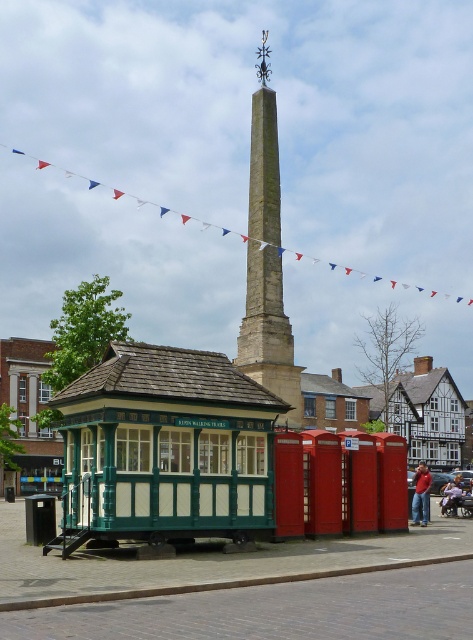
You are a tourist standing in the town square and want to take a photo of both the green wood gazebo at center and the smooth stone obelisk at center. Where should you position yourself relative to the gazebo and obelisk to capture both in the frame?

To capture both the green wood gazebo at center and the smooth stone obelisk at center in the frame, you should position yourself to the right of the green wood gazebo at center so that the obelisk is visible to the right of the gazebo.

You are standing at the point marked by the coordinates point [165,449] in the image. What structure are you directly at?

The point [165,449] indicates the green wood gazebo at center.